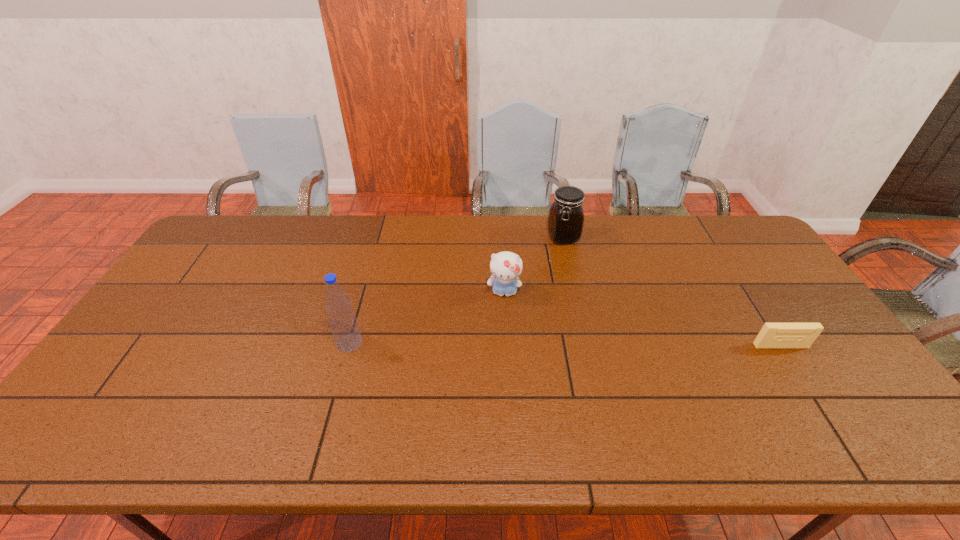
Locate an element on the screen. This screenshot has height=540, width=960. vacant space that is in between the shortest object and the water bottle is located at coordinates (565, 345).

Identify the location of blank region between the second object from right to left and the second object from left to right. (534, 265).

Where is `free point between the jar and the leftmost object`? The height and width of the screenshot is (540, 960). free point between the jar and the leftmost object is located at coordinates (456, 290).

You are a GUI agent. You are given a task and a screenshot of the screen. Output one action in this format:
    pyautogui.click(x=<x>, y=<y>)
    Task: Click on the vacant space in between the shortest object and the jar
    Image resolution: width=960 pixels, height=540 pixels.
    Given the screenshot: What is the action you would take?
    pyautogui.click(x=672, y=292)

This screenshot has height=540, width=960. In order to click on object that stands as the second closest to the kitten in this screenshot , I will do `click(343, 323)`.

Where is `object that is the second closest to the farthest object`? object that is the second closest to the farthest object is located at coordinates (772, 335).

This screenshot has width=960, height=540. I want to click on vacant area in the image that satisfies the following two spatial constraints: 1. on the back side of the second object from left to right; 2. on the right side of the leftmost object, so click(364, 293).